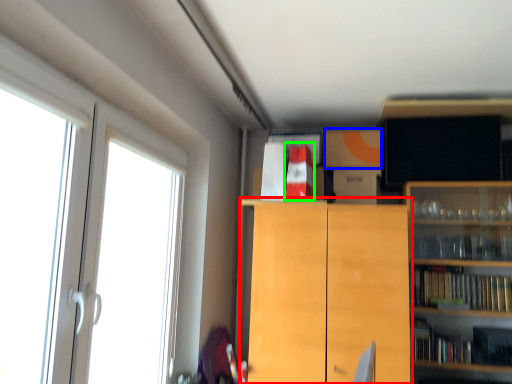
Question: Which object is positioned farthest from cabinetry (highlighted by a red box)? Select from cabinetry (highlighted by a blue box) and book (highlighted by a green box).

Choices:
 (A) cabinetry
 (B) book

Answer: (A)